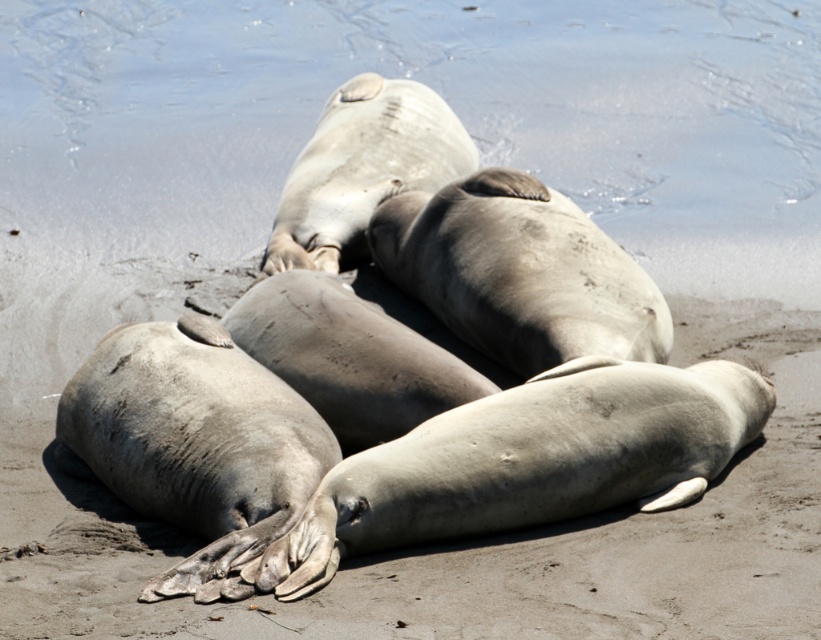
Does clear water at upper center appear on the right side of gray sandy beach at center?

Correct, you'll find clear water at upper center to the right of gray sandy beach at center.

The width and height of the screenshot is (821, 640). Describe the element at coordinates (447, 102) in the screenshot. I see `clear water at upper center` at that location.

I want to click on clear water at upper center, so click(x=447, y=102).